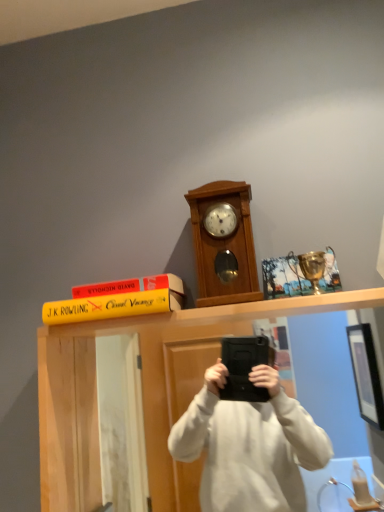
In order to face wooden clock at center, should I rotate leftwards or rightwards?

You should look right and rotate roughly 4.111 degrees.

This screenshot has width=384, height=512. I want to click on yellow matte book at upper center, so click(x=143, y=392).

Is wooden clock at center far from yellow matte book at upper center?

No, wooden clock at center is not far away from yellow matte book at upper center.

Could you tell me if wooden clock at center is facing yellow matte book at upper center?

No.

Considering the sizes of objects wooden clock at center and yellow matte book at upper center in the image provided, who is shorter, wooden clock at center or yellow matte book at upper center?

With less height is wooden clock at center.

Which object is positioned more to the right, wooden clock at center or yellow matte book at upper center?

wooden clock at center is more to the right.

The height and width of the screenshot is (512, 384). Find the location of `vanity that is in front of the wooden clock at center`. vanity that is in front of the wooden clock at center is located at coordinates (143, 392).

From the image's perspective, is yellow matte book at upper center located beneath wooden clock at center?

Correct, yellow matte book at upper center appears lower than wooden clock at center in the image.

Which object is closer to the camera taking this photo, yellow matte book at upper center or wooden clock at center?

yellow matte book at upper center is more forward.

Which is in front, point (148, 399) or point (236, 255)?

Positioned in front is point (236, 255).

Is the depth of yellow matte book at upper center less than that of yellow matte book at upper center?

Yes, yellow matte book at upper center is closer to the camera.

Can we say yellow matte book at upper center lies outside yellow matte book at upper center?

Absolutely, yellow matte book at upper center is external to yellow matte book at upper center.

Between point (155, 345) and point (157, 293), which one is positioned in front?

The point (157, 293) is closer to the camera.

From the image's perspective, would you say yellow matte book at upper center is shown under yellow matte book at upper center?

Correct, yellow matte book at upper center appears lower than yellow matte book at upper center in the image.

Does yellow matte book at upper center have a smaller size compared to yellow matte book at upper center?

Correct, yellow matte book at upper center occupies less space than yellow matte book at upper center.

Is point (137, 306) closer to viewer compared to point (67, 444)?

Yes, point (137, 306) is in front of point (67, 444).

Considering the relative sizes of yellow matte book at upper center and yellow matte book at upper center in the image provided, is yellow matte book at upper center taller than yellow matte book at upper center?

Incorrect, the height of yellow matte book at upper center is not larger of that of yellow matte book at upper center.

Is yellow matte book at upper center looking in the opposite direction of yellow matte book at upper center?

No, yellow matte book at upper center's orientation is not away from yellow matte book at upper center.

Which is in front, yellow matte book at upper center or wooden clock at center?

yellow matte book at upper center is closer to the camera.

Is yellow matte book at upper center not within wooden clock at center?

Yes, yellow matte book at upper center is located beyond the bounds of wooden clock at center.

In terms of size, does yellow matte book at upper center appear bigger or smaller than wooden clock at center?

yellow matte book at upper center is smaller than wooden clock at center.

From a real-world perspective, who is located higher, wooden clock at center or yellow matte book at upper center?

wooden clock at center.

Is yellow matte book at upper center surrounded by wooden clock at center?

No, yellow matte book at upper center is located outside of wooden clock at center.

Is wooden clock at center bigger than yellow matte book at upper center?

Correct, wooden clock at center is larger in size than yellow matte book at upper center.

Based on the photo, between wooden clock at center and yellow matte book at upper center, which one appears on the right side from the viewer's perspective?

From the viewer's perspective, wooden clock at center appears more on the right side.

Locate an element on the screen. Image resolution: width=384 pixels, height=512 pixels. vanity that is under the wooden clock at center (from a real-world perspective) is located at coordinates (143, 392).

Find the location of a particular element. vanity on the left of the wooden clock at center is located at coordinates (143, 392).

Based on their spatial positions, is yellow matte book at upper center or wooden clock at center closer to yellow matte book at upper center?

yellow matte book at upper center.

When comparing their distances from yellow matte book at upper center, does wooden clock at center or yellow matte book at upper center seem closer?

Based on the image, yellow matte book at upper center appears to be nearer to yellow matte book at upper center.

Based on their spatial positions, is wooden clock at center or yellow matte book at upper center further from yellow matte book at upper center?

wooden clock at center is further to yellow matte book at upper center.

When comparing their distances from wooden clock at center, does yellow matte book at upper center or yellow matte book at upper center seem closer?

Based on the image, yellow matte book at upper center appears to be nearer to wooden clock at center.

Estimate the real-world distances between objects in this image. Which object is closer to yellow matte book at upper center, yellow matte book at upper center or wooden clock at center?

yellow matte book at upper center is closer to yellow matte book at upper center.

Estimate the real-world distances between objects in this image. Which object is further from wooden clock at center, yellow matte book at upper center or yellow matte book at upper center?

The object further to wooden clock at center is yellow matte book at upper center.

Where is `book that lies between wooden clock at center and yellow matte book at upper center from top to bottom`? This screenshot has width=384, height=512. book that lies between wooden clock at center and yellow matte book at upper center from top to bottom is located at coordinates (111, 306).